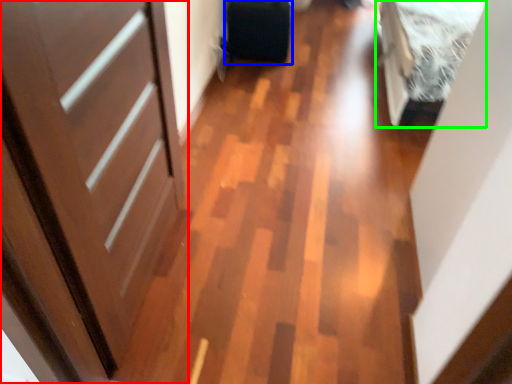
Question: Which object is positioned farthest from door (highlighted by a red box)? Select from luggage (highlighted by a blue box) and bed (highlighted by a green box).

Choices:
 (A) luggage
 (B) bed

Answer: (A)